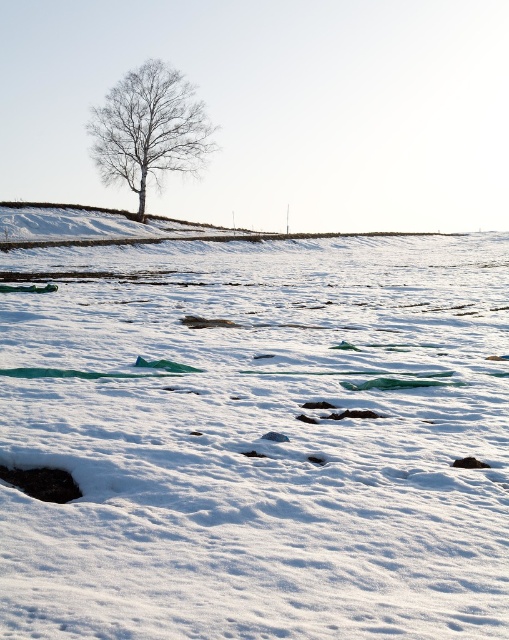
Can you confirm if white powdery snow at center is wider than bare white tree at center?

Correct, the width of white powdery snow at center exceeds that of bare white tree at center.

Can you confirm if white powdery snow at center is thinner than bare white tree at center?

In fact, white powdery snow at center might be wider than bare white tree at center.

Is point (11, 536) positioned before point (145, 115)?

Yes.

Locate an element on the screen. The image size is (509, 640). white powdery snow at center is located at coordinates (258, 440).